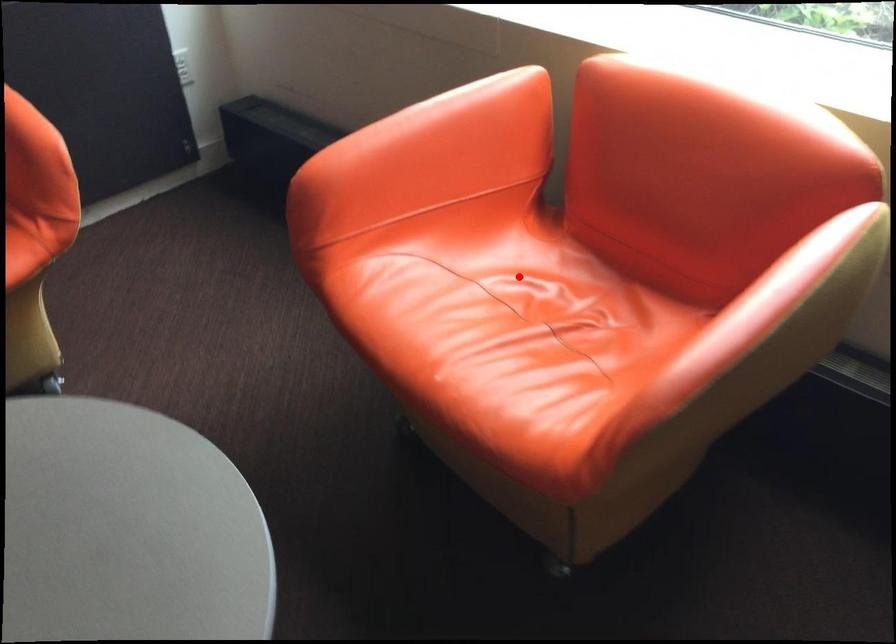
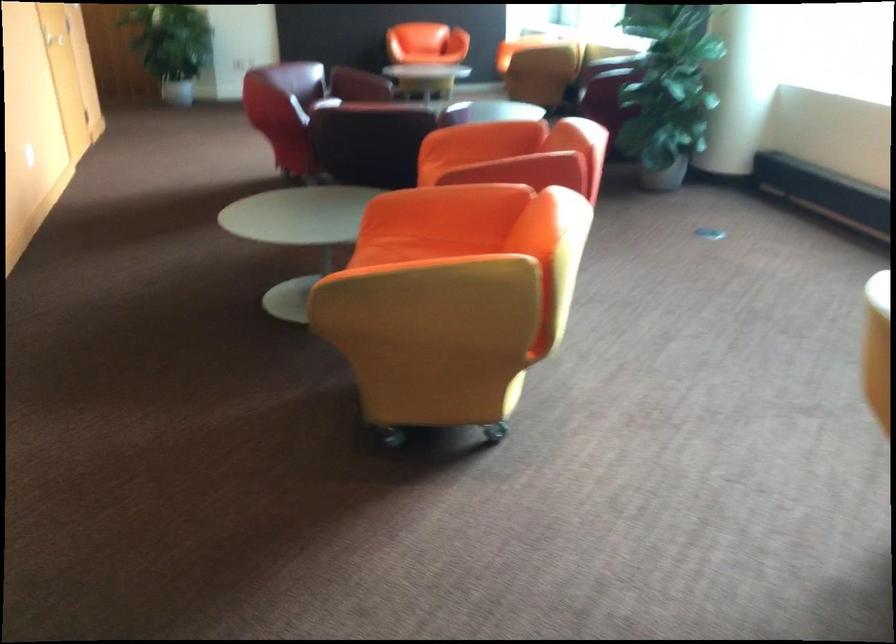
Question: I am providing you with two images of the same scene from different viewpoints. A red point is marked on the first image. Can you still see the location of the red point in image 2?

Choices:
 (A) Yes
 (B) No

Answer: (B)